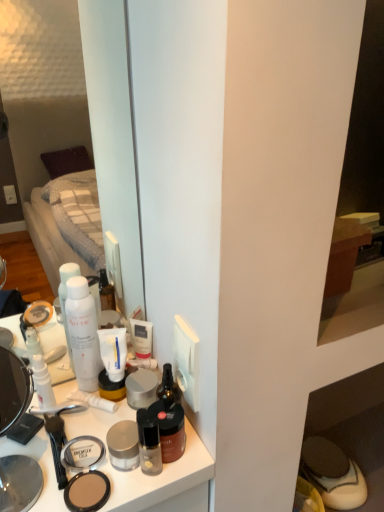
Question: Is white matte tube at center oriented away from matte brown shoe at lower right?

Choices:
 (A) no
 (B) yes

Answer: (A)

Question: Is white matte tube at center wider than matte brown shoe at lower right?

Choices:
 (A) yes
 (B) no

Answer: (B)

Question: Can you confirm if white matte tube at center is shorter than matte brown shoe at lower right?

Choices:
 (A) no
 (B) yes

Answer: (A)

Question: Can you confirm if white matte tube at center is bigger than matte brown shoe at lower right?

Choices:
 (A) yes
 (B) no

Answer: (B)

Question: Is matte brown shoe at lower right located within white matte tube at center?

Choices:
 (A) yes
 (B) no

Answer: (B)

Question: Is white matte tube at center at the right side of matte brown shoe at lower right?

Choices:
 (A) yes
 (B) no

Answer: (B)

Question: Is satin silver face powder at center, the third face powder viewed from the front, facing towards matte black compact at center, marked as the third face powder in a back-to-front arrangement?

Choices:
 (A) no
 (B) yes

Answer: (A)

Question: Does satin silver face powder at center, which is the first face powder in back-to-front order, have a lesser width compared to matte black compact at center, the 1th face powder when ordered from front to back?

Choices:
 (A) no
 (B) yes

Answer: (B)

Question: From a real-world perspective, is satin silver face powder at center, which is the first face powder in back-to-front order, positioned over matte black compact at center, marked as the third face powder in a back-to-front arrangement, based on gravity?

Choices:
 (A) yes
 (B) no

Answer: (A)

Question: Is satin silver face powder at center, the third face powder viewed from the front, far from matte black compact at center, marked as the third face powder in a back-to-front arrangement?

Choices:
 (A) no
 (B) yes

Answer: (A)

Question: Considering the relative sizes of satin silver face powder at center, the third face powder viewed from the front, and matte black compact at center, the 1th face powder when ordered from front to back, in the image provided, is satin silver face powder at center, the third face powder viewed from the front, shorter than matte black compact at center, the 1th face powder when ordered from front to back,?

Choices:
 (A) yes
 (B) no

Answer: (B)

Question: Is satin silver face powder at center, which is the first face powder in back-to-front order, taller than matte black compact at center, marked as the third face powder in a back-to-front arrangement?

Choices:
 (A) no
 (B) yes

Answer: (B)

Question: Is matte plastic makeup at center behind white matte pump bottle at upper left, which is the fourth toiletry from right to left?

Choices:
 (A) no
 (B) yes

Answer: (A)